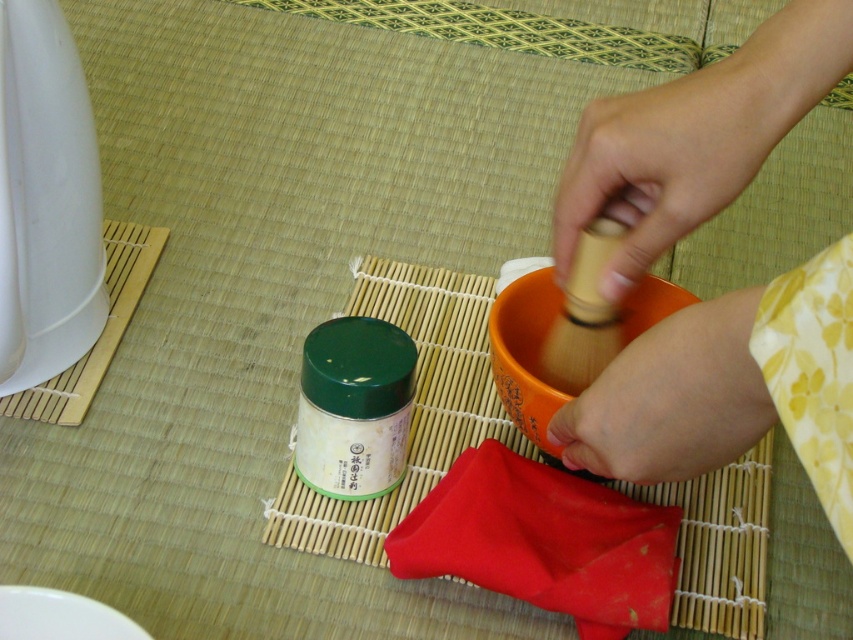
You are preparing for a Japanese tea ceremony and need to locate the wooden rolling pin at upper right and the wooden whisk at center. According to the scene, which object is positioned to the right of the other?

The wooden rolling pin at upper right is positioned to the right of the wooden whisk at center.

You are preparing for a traditional Japanese tea ceremony and need to store the wooden rolling pin at upper right and the wooden whisk at center in a drawer. The drawer has a width of 12 centimeters. Based on their widths, can both items fit side by side in the drawer?

The wooden rolling pin at upper right might be wider than the wooden whisk at center. If the rolling pin is indeed wider than the whisk, their combined width could exceed the drawer space of 12 centimeters, making it uncertain whether they can fit side by side. The exact dimensions are needed for a definitive answer.

You are preparing to roll out dough for a traditional Japanese pastry and need to choose between the wooden rolling pin at upper right and the wooden rolling pin at upper center. Which one is more suitable for rolling out a larger piece of dough?

The wooden rolling pin at upper right is larger in size compared to the wooden rolling pin at upper center, making it more suitable for rolling out a larger piece of dough.